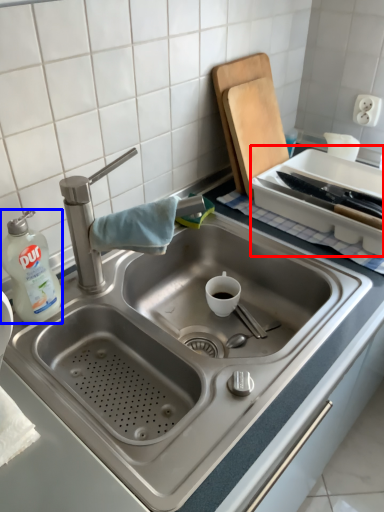
Question: Which of the following is the farthest to the observer, appliance (highlighted by a red box) or cleaning product (highlighted by a blue box)?

Choices:
 (A) appliance
 (B) cleaning product

Answer: (A)